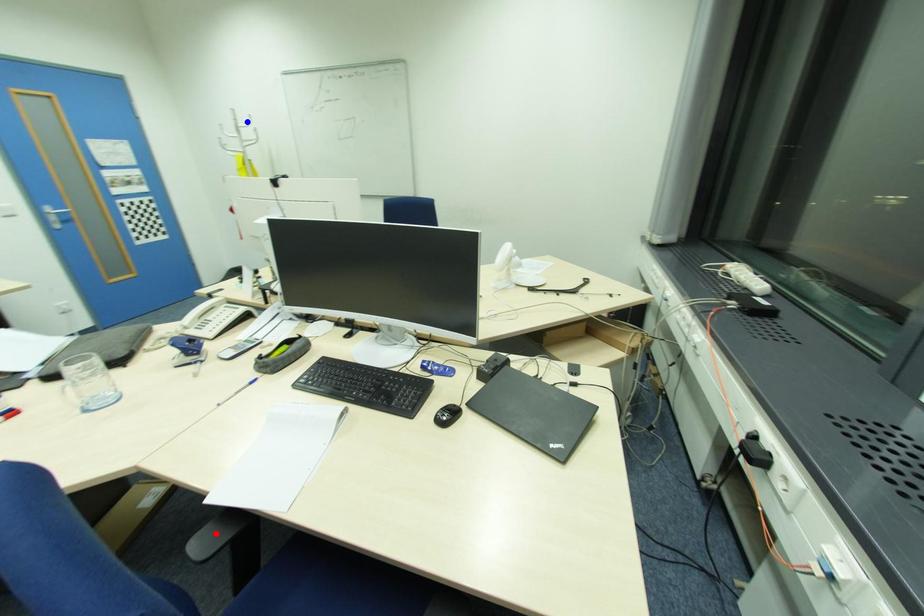
Question: In the image, two points are highlighted. Which point is nearer to the camera? Reply with the corresponding letter.

Choices:
 (A) blue point
 (B) red point

Answer: (B)